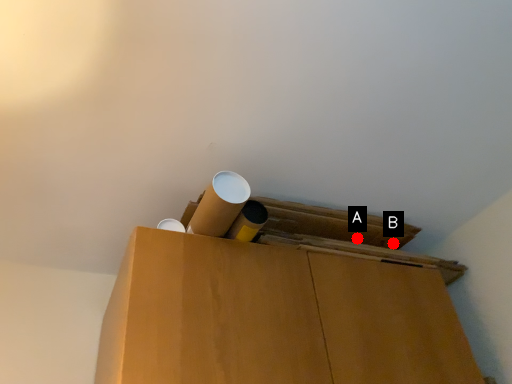
Question: Two points are circled on the image, labeled by A and B beside each circle. Which point appears farthest from the camera in this image?

Choices:
 (A) A is further
 (B) B is further

Answer: (B)